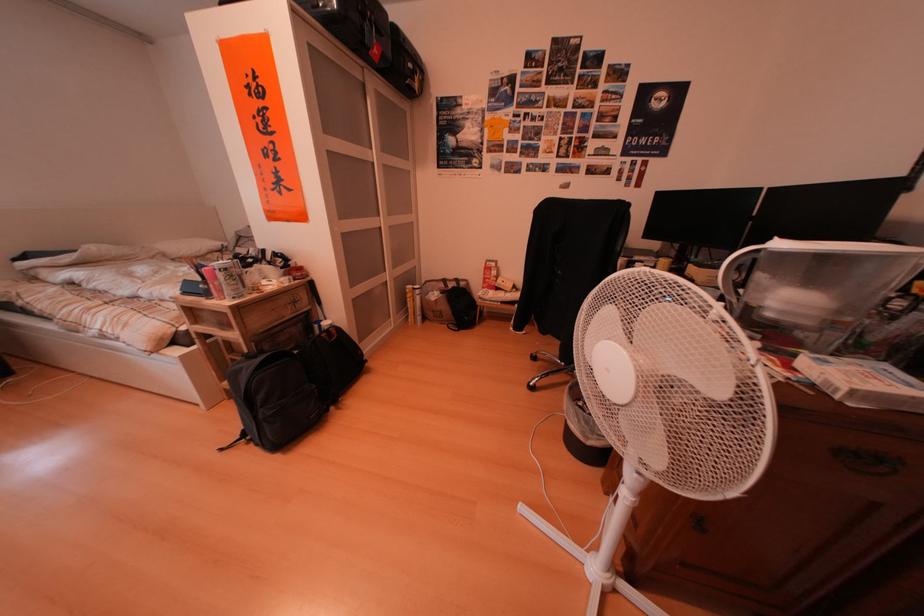
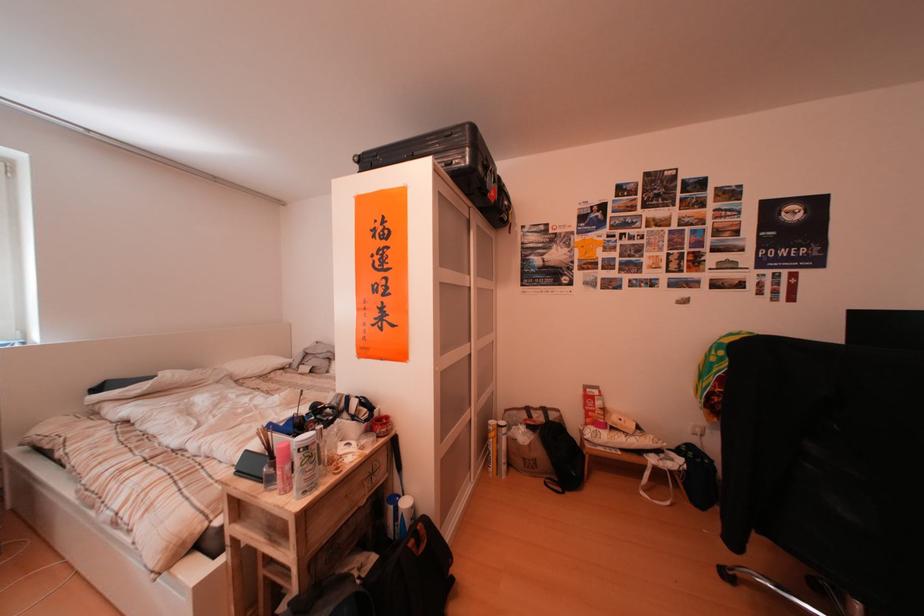
In the second image, find the point that corresponds to (x=456, y=286) in the first image.

(541, 415)